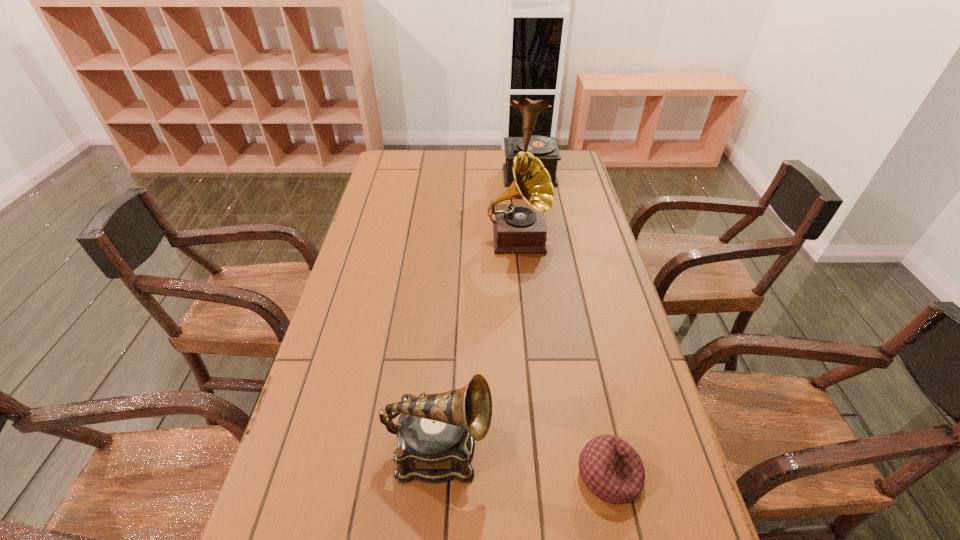
Where is `empty space between the farthest phonograph record and the third tallest object`? The width and height of the screenshot is (960, 540). empty space between the farthest phonograph record and the third tallest object is located at coordinates (484, 312).

In order to click on vacant area that lies between the beanbag and the leftmost phonograph record in this screenshot , I will do [524, 462].

Find the location of `unoccupied area between the beanbag and the farthest object`. unoccupied area between the beanbag and the farthest object is located at coordinates (569, 326).

You are a GUI agent. You are given a task and a screenshot of the screen. Output one action in this format:
    pyautogui.click(x=<x>, y=<y>)
    Task: Click on the vacant area between the beanbag and the third nearest object
    
    Given the screenshot: What is the action you would take?
    pyautogui.click(x=563, y=356)

Locate an element on the screen. The height and width of the screenshot is (540, 960). empty space that is in between the shortest object and the second nearest phonograph record is located at coordinates (563, 356).

Locate an element on the screen. free space between the farthest phonograph record and the shortest object is located at coordinates (x=569, y=326).

The width and height of the screenshot is (960, 540). What are the coordinates of `free spot between the farthest phonograph record and the beanbag` in the screenshot? It's located at (569, 326).

Where is `vacant space in between the shortest object and the third nearest object`? This screenshot has height=540, width=960. vacant space in between the shortest object and the third nearest object is located at coordinates (563, 356).

Find the location of a particular element. This screenshot has width=960, height=540. object that ranks as the third closest to the shortest phonograph record is located at coordinates (544, 148).

Locate an element on the screen. The image size is (960, 540). object that stands as the third closest to the leftmost phonograph record is located at coordinates (544, 148).